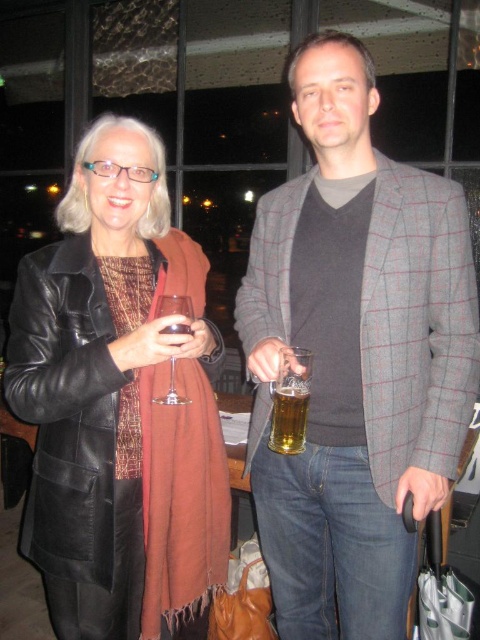
You are at a party and need to grab the translucent glass beer at center without touching the gray checkered blazer at center. Can you reach it? Explain why based on their positions.

The gray checkered blazer at center is to the right of the translucent glass beer at center, so you can reach the translucent glass beer at center by moving to its left side without disturbing the blazer.